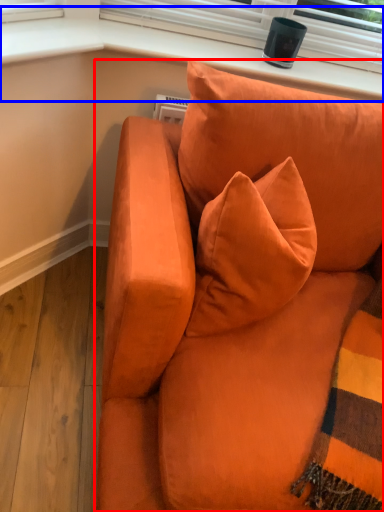
Question: Among these objects, which one is farthest to the camera, studio couch (highlighted by a red box) or window sill (highlighted by a blue box)?

Choices:
 (A) studio couch
 (B) window sill

Answer: (B)